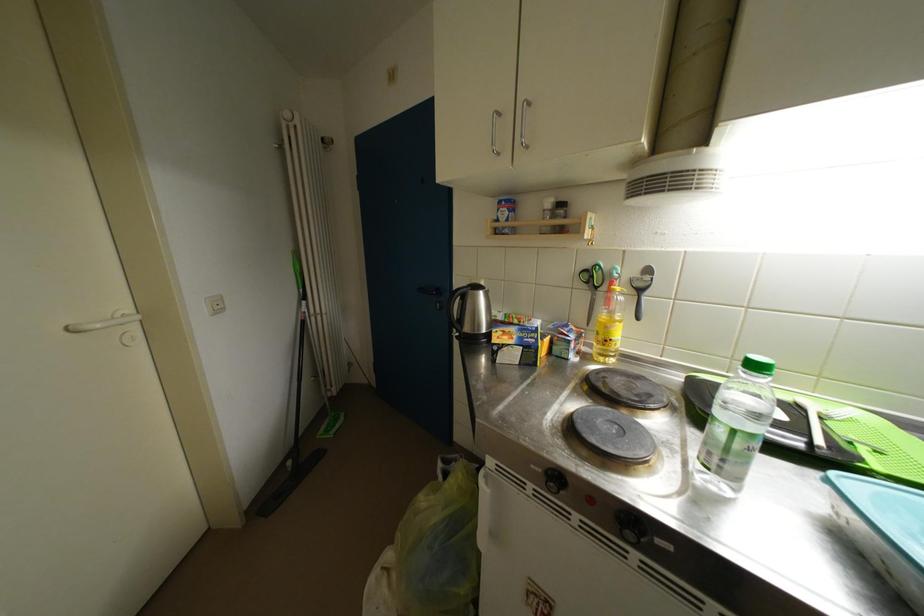
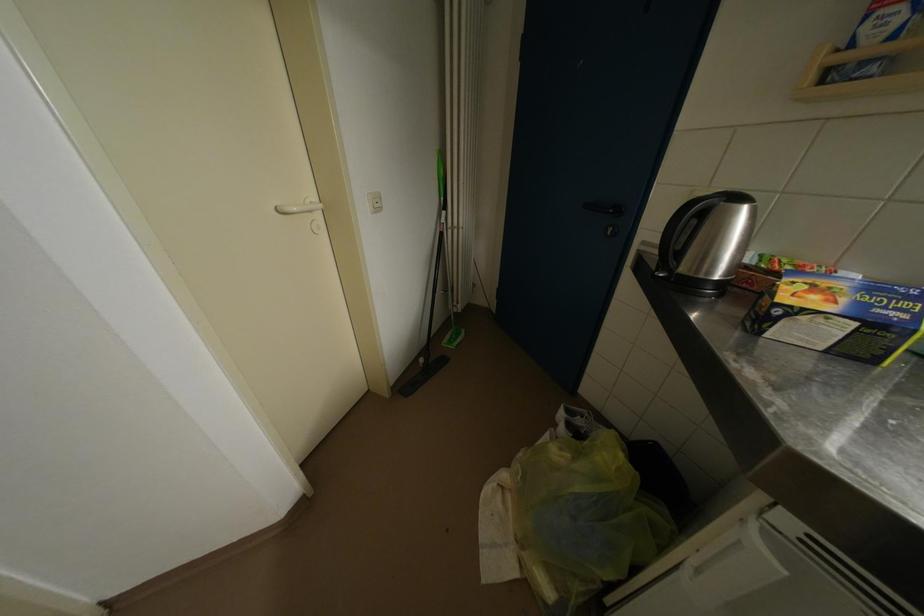
Based on the continuous images, in which direction is the camera rotating?

The camera rotated toward left-down.